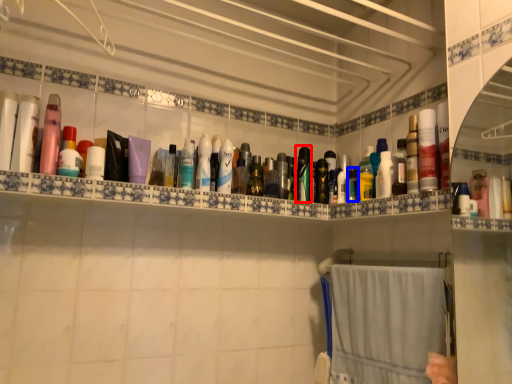
Question: Which point is closer to the camera, toiletry (highlighted by a red box) or toiletry (highlighted by a blue box)?

Choices:
 (A) toiletry
 (B) toiletry

Answer: (B)